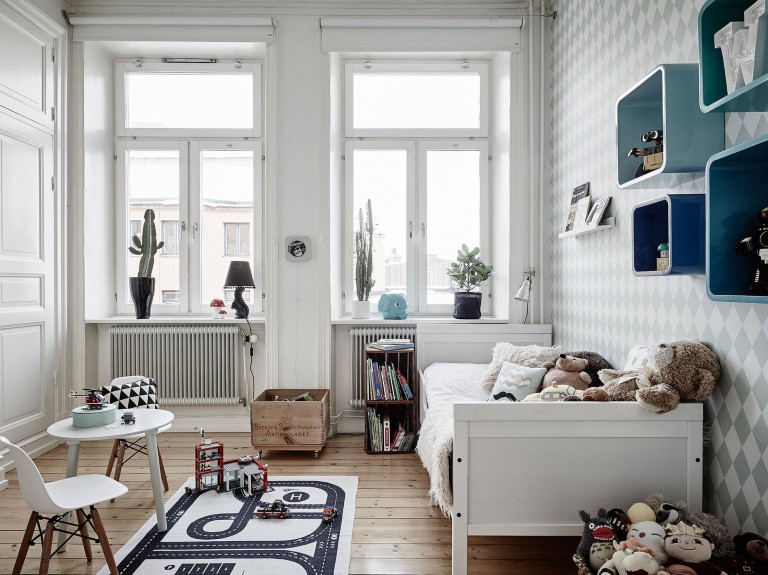
Image resolution: width=768 pixels, height=575 pixels. I want to click on pile of plushies, so click(667, 555).